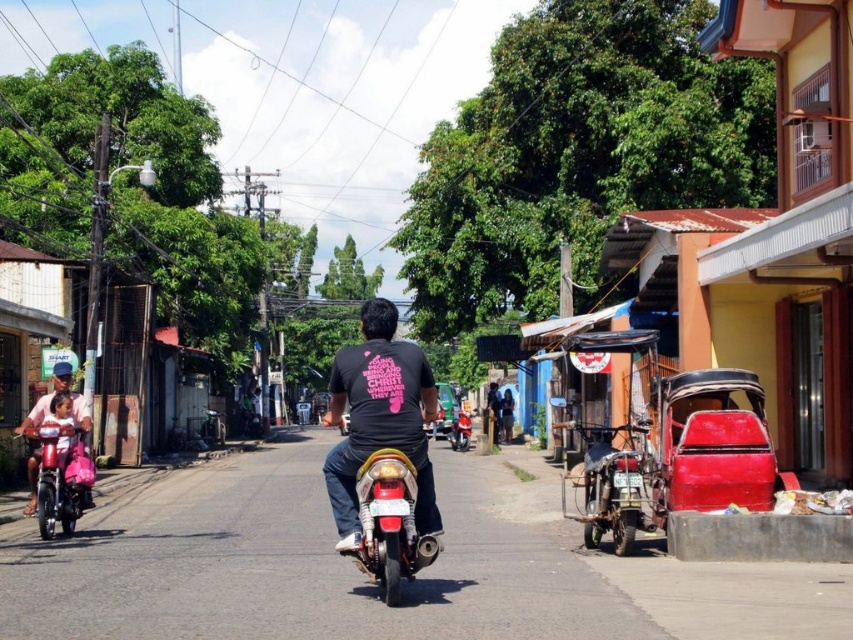
You are a photographer aiming to capture the man in the black matte shirt at center and the metallic red motorcycle at center. Since you want to focus on the man, which object should be placed closer to the camera lens?

The black matte shirt at center should be placed closer to the camera lens because it has a greater height compared to the metallic red motorcycle at center, making it the primary focus.

You are standing at the point marked as point (405, 342) in the image. You want to cross the street to reach a bench on the opposite side. The bench is 10 meters away from your current position. Can you safely cross the street without walking more than 12 meters?

The distance between you and the bench is 10 meters, which is less than the 12 meters limit. Therefore, you can safely cross the street without exceeding the distance limit.